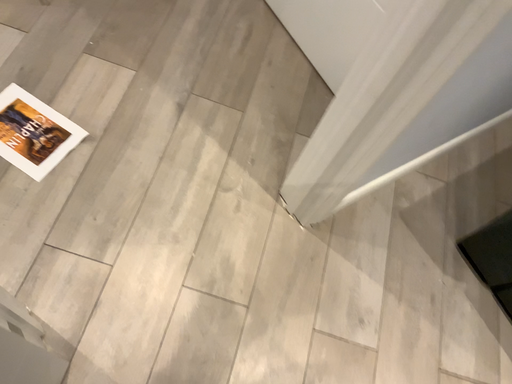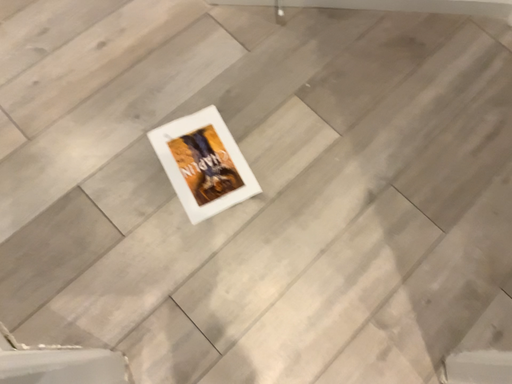
Question: Which way did the camera rotate in the video?

Choices:
 (A) rotated left
 (B) rotated right

Answer: (A)